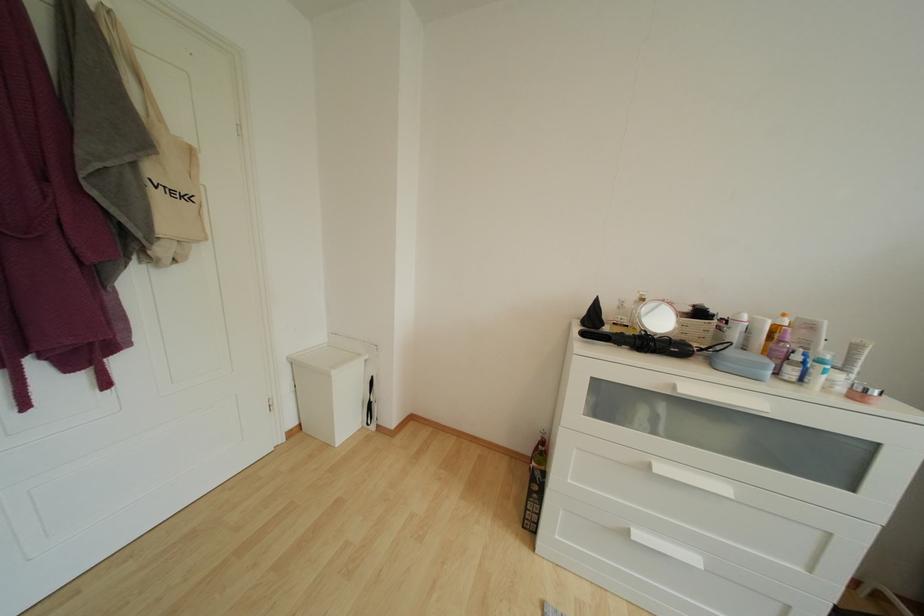
The image size is (924, 616). What do you see at coordinates (322, 358) in the screenshot?
I see `the white bin lid` at bounding box center [322, 358].